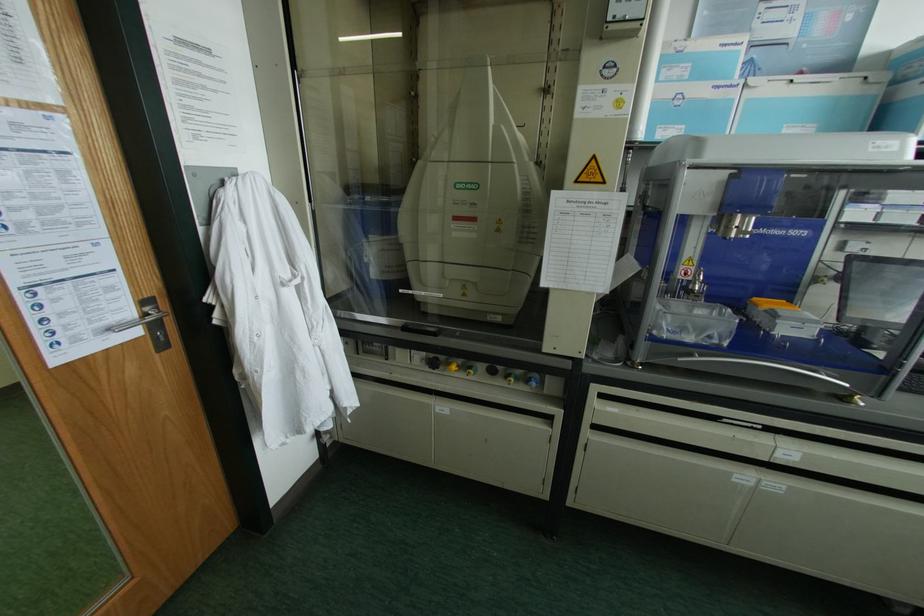
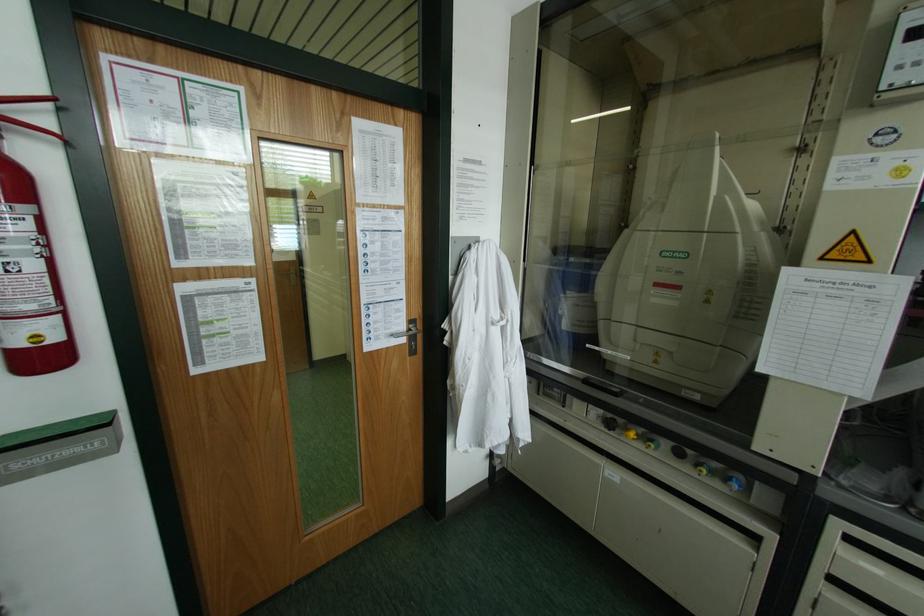
Find the pixel in the second image that matches (524,235) in the first image.

(743, 310)